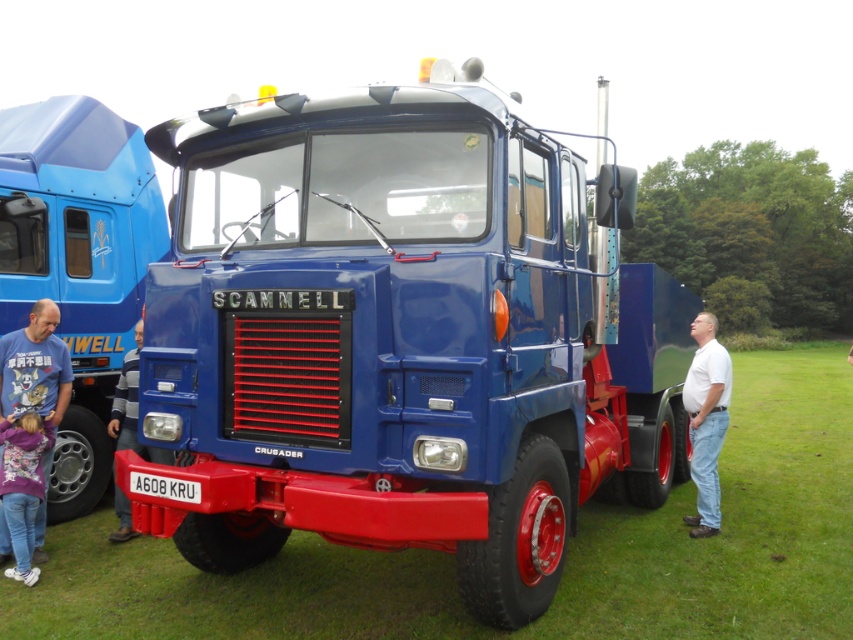
Does glossy blue truck at center come behind matte blue truck at center?

No.

Which is below, glossy blue truck at center or matte blue truck at center?

glossy blue truck at center

Who is more forward, (646, 384) or (115, 138)?

Point (646, 384) is more forward.

In order to click on glossy blue truck at center in this screenshot , I will do `click(399, 339)`.

Can you confirm if matte blue truck at center is positioned to the left of white cotton shirt at center?

Indeed, matte blue truck at center is positioned on the left side of white cotton shirt at center.

The height and width of the screenshot is (640, 853). What do you see at coordinates (78, 260) in the screenshot? I see `matte blue truck at center` at bounding box center [78, 260].

Where is `matte blue truck at center`? The height and width of the screenshot is (640, 853). matte blue truck at center is located at coordinates (78, 260).

Who is positioned more to the left, glossy blue truck at center or white cotton shirt at center?

Positioned to the left is glossy blue truck at center.

This screenshot has width=853, height=640. Describe the element at coordinates (399, 339) in the screenshot. I see `glossy blue truck at center` at that location.

At what (x,y) coordinates should I click in order to perform the action: click on glossy blue truck at center. Please return your answer as a coordinate pair (x, y). The width and height of the screenshot is (853, 640). Looking at the image, I should click on (399, 339).

You are a GUI agent. You are given a task and a screenshot of the screen. Output one action in this format:
    pyautogui.click(x=<x>, y=<y>)
    Task: Click on the glossy blue truck at center
    
    Given the screenshot: What is the action you would take?
    pyautogui.click(x=399, y=339)